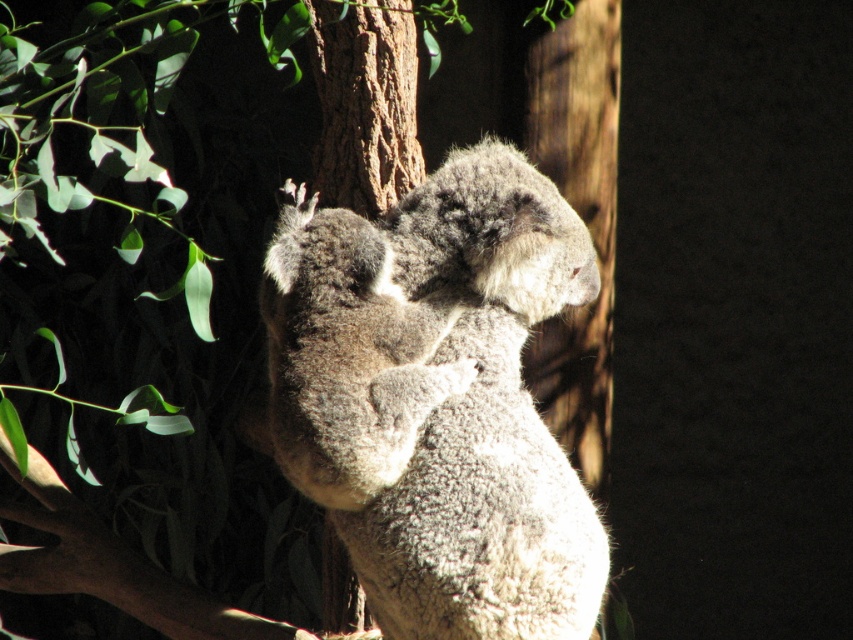
Which of these two, fuzzy gray koala at center or brown textured tree trunk at center, stands taller?

Standing taller between the two is brown textured tree trunk at center.

Describe the element at coordinates (437, 400) in the screenshot. Image resolution: width=853 pixels, height=640 pixels. I see `fuzzy gray koala at center` at that location.

Locate an element on the screen. This screenshot has height=640, width=853. fuzzy gray koala at center is located at coordinates (437, 400).